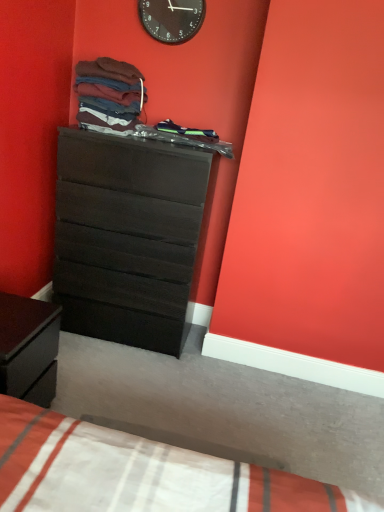
Image resolution: width=384 pixels, height=512 pixels. What are the coordinates of `vacant area that is in front of matte black dresser at center` in the screenshot? It's located at (130, 386).